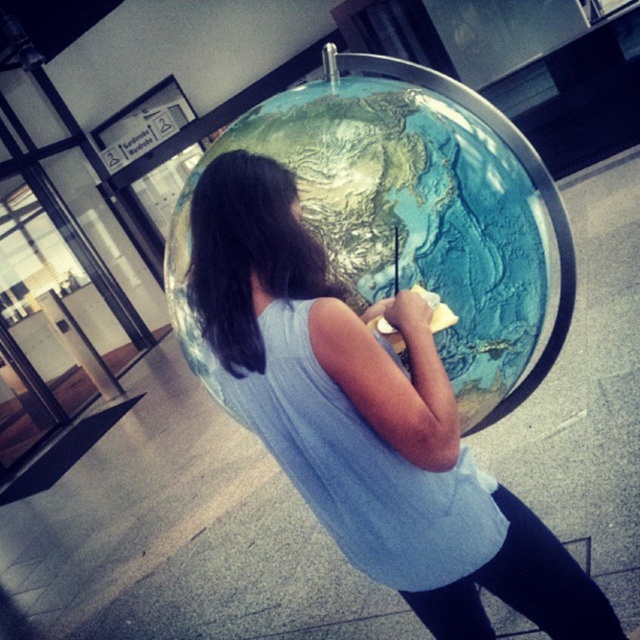
Where is `matte blue shirt at center`? The width and height of the screenshot is (640, 640). matte blue shirt at center is located at coordinates (365, 419).

Where is `matte blue shirt at center`? The width and height of the screenshot is (640, 640). matte blue shirt at center is located at coordinates (365, 419).